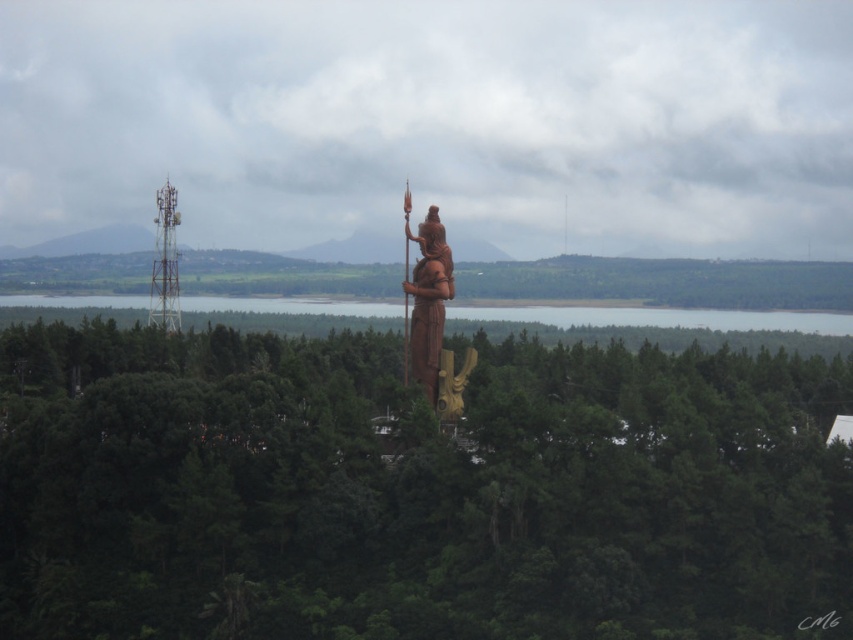
Question: Which point is farther to the camera?

Choices:
 (A) (407, 301)
 (B) (602, 316)
 (C) (341, 460)

Answer: (B)

Question: Which point is closer to the camera taking this photo?

Choices:
 (A) (592, 317)
 (B) (405, 317)
 (C) (763, 636)
 (D) (155, 202)

Answer: (C)

Question: Is the position of green water at center more distant than that of metallic tower at left?

Choices:
 (A) yes
 (B) no

Answer: (B)

Question: Is green water at center to the right of wooden statue at center from the viewer's perspective?

Choices:
 (A) yes
 (B) no

Answer: (B)

Question: Which point is farther from the camera taking this photo?

Choices:
 (A) (267, 310)
 (B) (434, 218)
 (C) (405, 252)

Answer: (A)

Question: In this image, where is green matte tree at center located relative to brown wooden statue at center?

Choices:
 (A) below
 (B) above

Answer: (A)